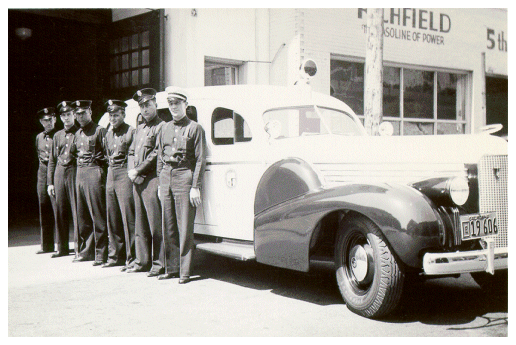
Where is `door`? door is located at coordinates click(214, 75).